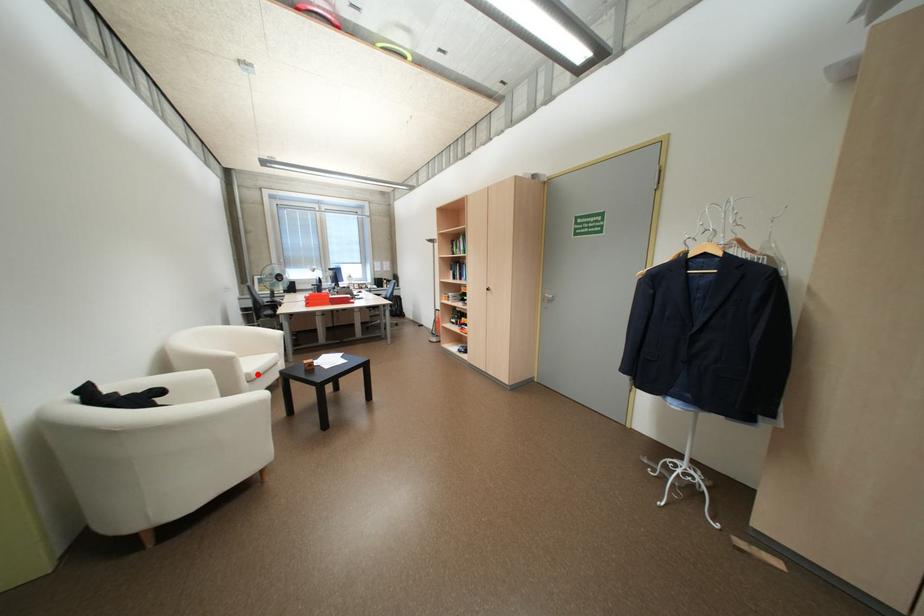
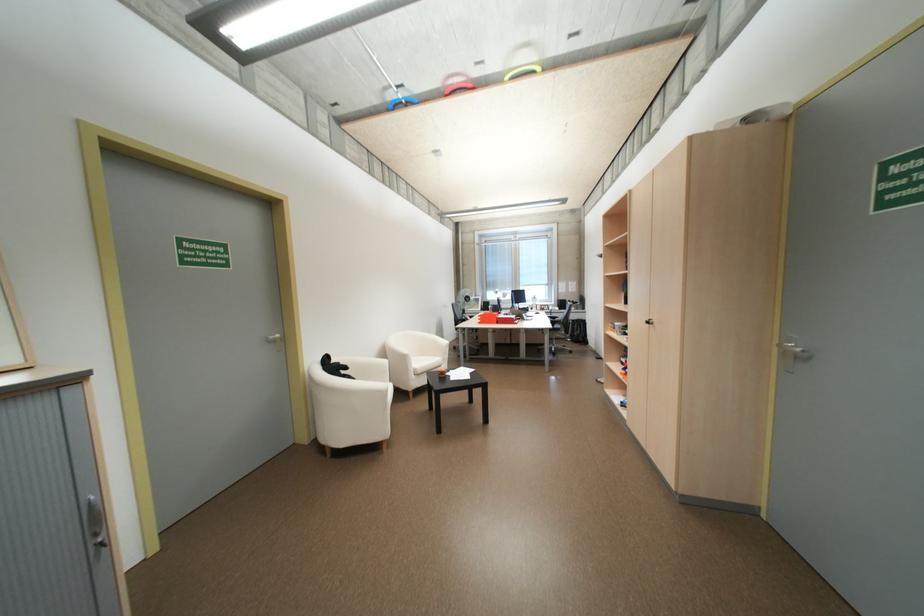
Locate, in the second image, the point that corresponds to the highlighted location in the first image.

(424, 369)